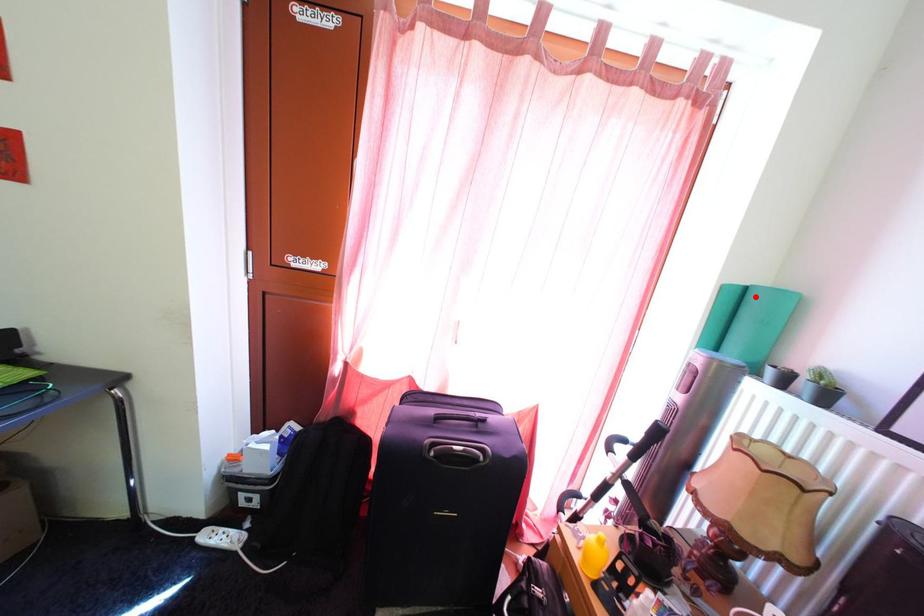
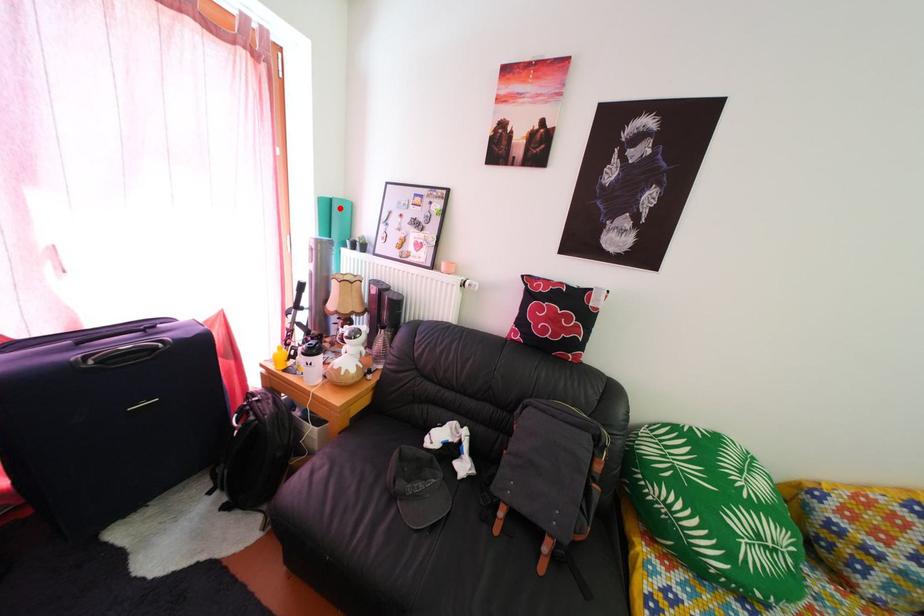
I am providing you with two images of the same scene from different viewpoints. A red point is marked on the first image and another point is marked on the second image. Is the marked point in image1 the same physical position as the marked point in image2?

Yes